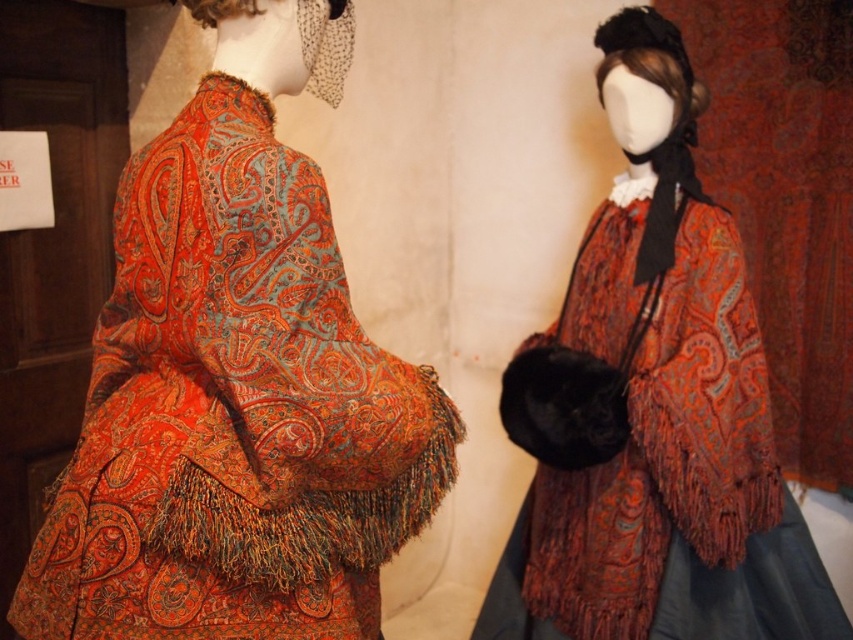
Is paisley-patterned fabric at center further to the viewer compared to matte paisley cape at center?

No.

Between point (283, 540) and point (741, 490), which one is positioned in front?

Positioned in front is point (283, 540).

Where is `paisley-patterned fabric at center`? The width and height of the screenshot is (853, 640). paisley-patterned fabric at center is located at coordinates click(236, 381).